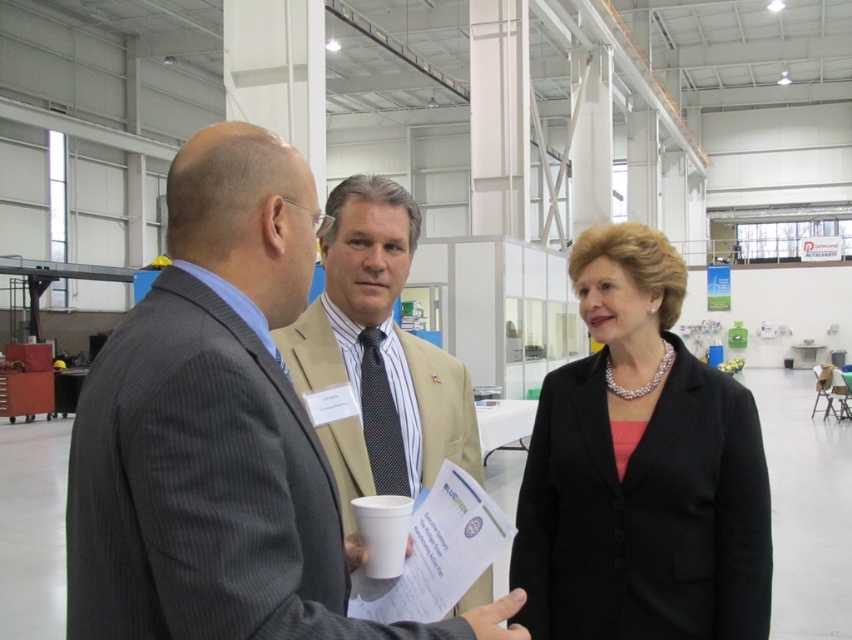
In the scene, there are three people. The first is wearing a dark pinstripe suit on the left, the second is wearing a gray pinstripe suit at center, and the third is on the right. If you were standing at the origin point, which person is closest to the point at coordinates 0.766, 0.239?

The gray pinstripe suit at center is closest to the point at coordinates (203, 490) because the description states that the position of gray pinstripe suit at center is at point (203, 490).

You are an event organizer who needs to arrange seating for the gray pinstripe suit at center and the black satin blazer at center. Which of the two requires a larger seating space?

The black satin blazer at center requires a larger seating space because the gray pinstripe suit at center occupies less space than the black satin blazer at center.